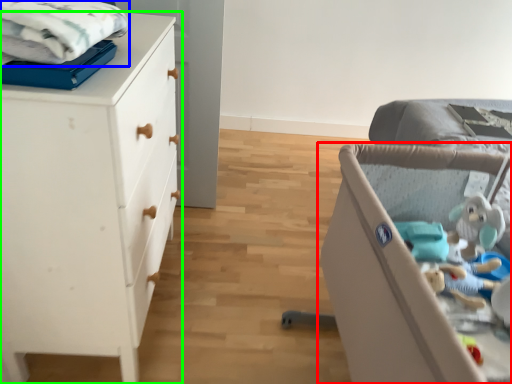
Question: Estimate the real-world distances between objects in this image. Which object is closer to infant bed (highlighted by a red box), cloth (highlighted by a blue box) or chest of drawers (highlighted by a green box)?

Choices:
 (A) cloth
 (B) chest of drawers

Answer: (B)